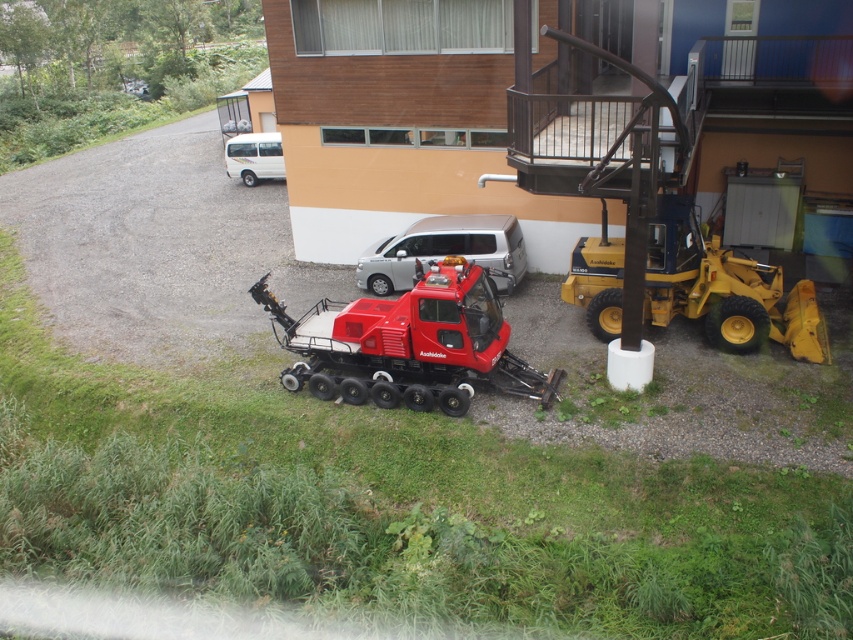
You are a delivery person trying to park your vehicle in the parking area. You see the matte red snowcat at center and the yellow rubber tractor at right. Which vehicle is parked lower in the image?

The matte red snowcat at center is located below the yellow rubber tractor at right, so it is parked lower in the image.

You are a delivery person trying to park your truck in the parking area. You see the matte red snowcat at center and the silver metallic van at center. Which vehicle should you move closer to if you want to park as close as possible to the building?

The silver metallic van at center is parked closer to the building than the matte red snowcat at center, so you should move closer to the silver metallic van at center to park as close as possible to the building.